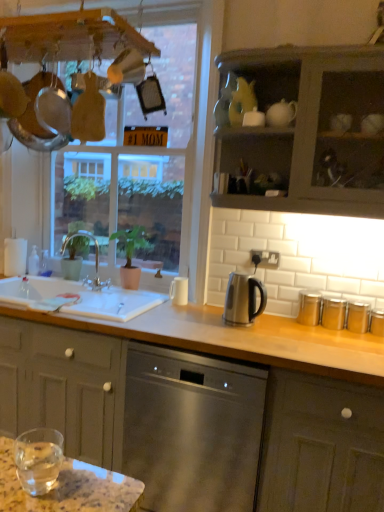
Question: Does matte gray cabinet at lower right, marked as the 2th cabinetry in a top-to-bottom arrangement, have a smaller size compared to clear glass water at lower left?

Choices:
 (A) yes
 (B) no

Answer: (B)

Question: Is matte gray cabinet at lower right, marked as the 2th cabinetry in a top-to-bottom arrangement, completely or partially outside of clear glass water at lower left?

Choices:
 (A) yes
 (B) no

Answer: (A)

Question: Is matte gray cabinet at lower right, the first cabinetry from the bottom, closer to camera compared to clear glass water at lower left?

Choices:
 (A) no
 (B) yes

Answer: (A)

Question: Is matte gray cabinet at lower right, the first cabinetry from the bottom, far from clear glass water at lower left?

Choices:
 (A) no
 (B) yes

Answer: (B)

Question: Would you say clear glass water at lower left is part of matte gray cabinet at lower right, the first cabinetry from the bottom,'s contents?

Choices:
 (A) yes
 (B) no

Answer: (B)

Question: Considering the positions of clear glass window at upper center and satin silver kettle at center in the image, is clear glass window at upper center taller or shorter than satin silver kettle at center?

Choices:
 (A) tall
 (B) short

Answer: (A)

Question: Looking at their shapes, would you say clear glass window at upper center is wider or thinner than satin silver kettle at center?

Choices:
 (A) thin
 (B) wide

Answer: (B)

Question: Is clear glass window at upper center to the left or to the right of satin silver kettle at center in the image?

Choices:
 (A) left
 (B) right

Answer: (A)

Question: Is point (125, 197) closer or farther from the camera than point (225, 304)?

Choices:
 (A) farther
 (B) closer

Answer: (A)

Question: Considering the relative positions of brushed metal faucet at sink left and clear glass window at upper center in the image provided, is brushed metal faucet at sink left to the left or to the right of clear glass window at upper center?

Choices:
 (A) left
 (B) right

Answer: (A)

Question: From the image's perspective, relative to clear glass window at upper center, is brushed metal faucet at sink left above or below?

Choices:
 (A) above
 (B) below

Answer: (B)

Question: Considering the positions of brushed metal faucet at sink left and clear glass window at upper center in the image, is brushed metal faucet at sink left bigger or smaller than clear glass window at upper center?

Choices:
 (A) big
 (B) small

Answer: (B)

Question: Considering the positions of point (89, 287) and point (210, 138), is point (89, 287) closer or farther from the camera than point (210, 138)?

Choices:
 (A) farther
 (B) closer

Answer: (A)

Question: Does point (246, 289) appear closer or farther from the camera than point (296, 74)?

Choices:
 (A) closer
 (B) farther

Answer: (A)

Question: Which is correct: satin silver kettle at center is inside matte gray cabinet at upper right, acting as the second cabinetry starting from the bottom, or outside of it?

Choices:
 (A) outside
 (B) inside

Answer: (A)